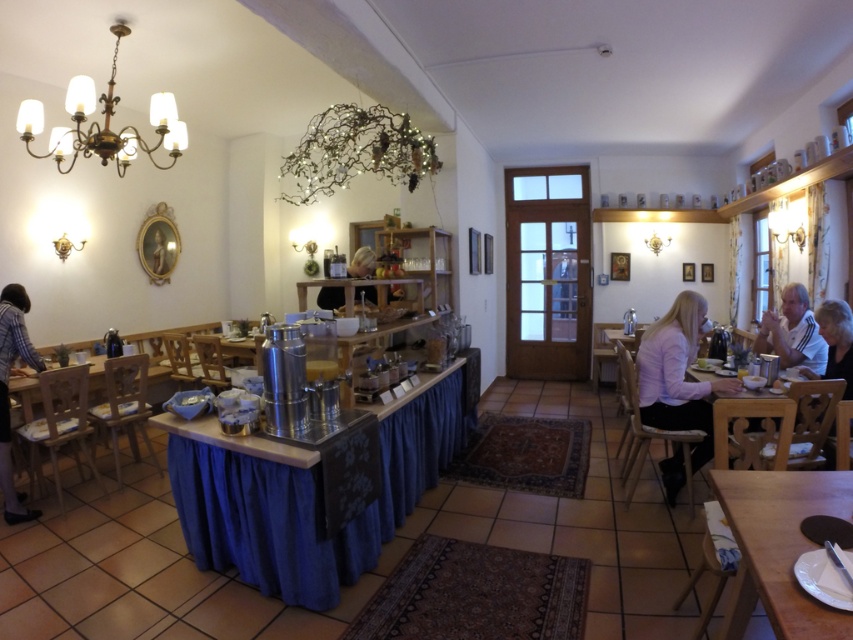
Question: Does blue fabric table at center have a smaller size compared to blonde hair at center?

Choices:
 (A) no
 (B) yes

Answer: (A)

Question: Where is blue fabric table at center located in relation to white textured shirt at right in the image?

Choices:
 (A) right
 (B) left

Answer: (B)

Question: Among these points, which one is nearest to the camera?

Choices:
 (A) (16, 342)
 (B) (381, 474)
 (C) (848, 355)

Answer: (B)

Question: Which object is positioned farthest from the plaid shirt at left?

Choices:
 (A) wooden table at lower right
 (B) white textured shirt at right
 (C) wooden table at lower left

Answer: (B)

Question: Based on their relative distances, which object is farther from the wooden table at lower left?

Choices:
 (A) matte brass chandelier at upper left
 (B) blue fabric table at center
 (C) plaid shirt at left
 (D) white textured shirt at right

Answer: (D)

Question: From the image, what is the correct spatial relationship of wooden table at right in relation to matte brass chandelier at upper left?

Choices:
 (A) right
 (B) left

Answer: (A)